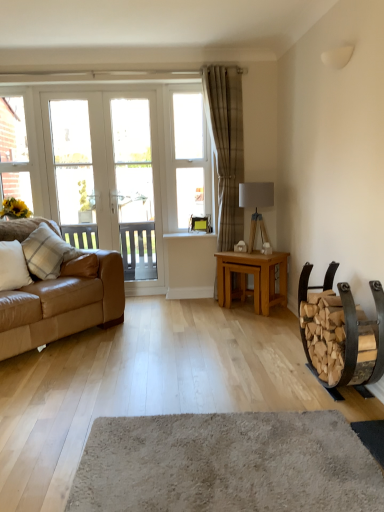
You are a GUI agent. You are given a task and a screenshot of the screen. Output one action in this format:
    pyautogui.click(x=<x>, y=<y>)
    Task: Click on the vacant point to the left of light oak table at center
    Image resolution: width=384 pixels, height=512 pixels.
    Given the screenshot: What is the action you would take?
    pyautogui.click(x=206, y=308)